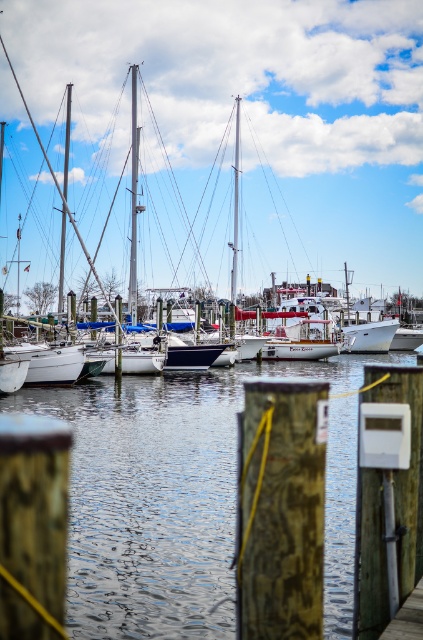
You are standing on the dock and want to board the white matte sailboat at left. Which direction should you look to see the clear water at center below it?

The white matte sailboat at left is located above the clear water at center, so you should look downward towards the clear water at center to see it below the boat.

You are standing at the edge of the marina looking out. There are two points marked on the dock. One is at coordinates point (417, 246) and the other at point (404, 605). Which point is closer to you?

Point (404, 605) is closer to you because it is in front of point (417, 246).